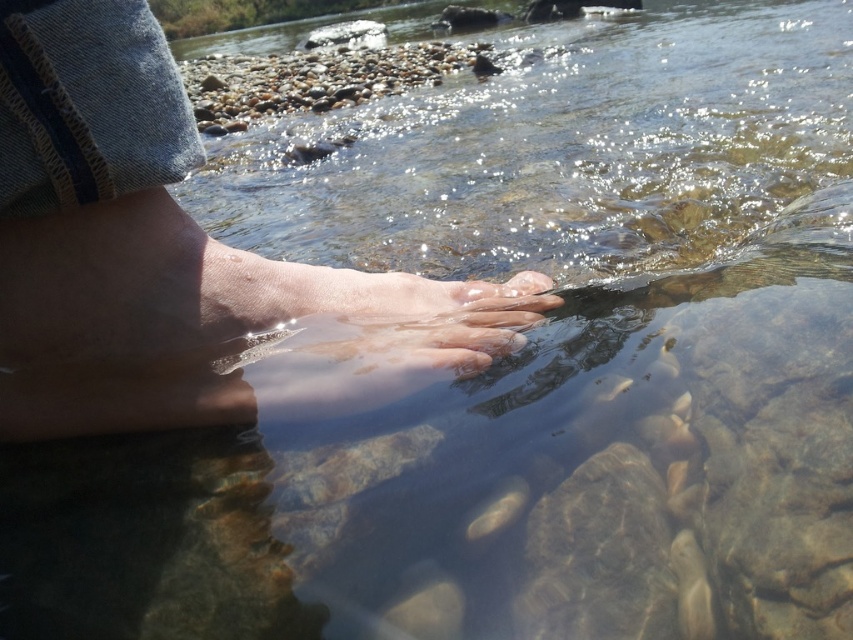
Question: From the image, what is the correct spatial relationship of smooth skin foot at center in relation to translucent flesh at center?

Choices:
 (A) below
 (B) above

Answer: (A)

Question: Can you confirm if smooth skin foot at center is positioned to the right of translucent flesh at center?

Choices:
 (A) yes
 (B) no

Answer: (B)

Question: Which object appears farthest from the camera in this image?

Choices:
 (A) translucent flesh at center
 (B) smooth skin foot at center

Answer: (A)

Question: Which object is closer to the camera taking this photo?

Choices:
 (A) smooth skin foot at center
 (B) translucent flesh at center

Answer: (A)

Question: Which point is farther from the camera taking this photo?

Choices:
 (A) coord(155,324)
 (B) coord(524,275)

Answer: (B)

Question: From the image, what is the correct spatial relationship of smooth skin foot at center in relation to translucent flesh at center?

Choices:
 (A) right
 (B) left

Answer: (B)